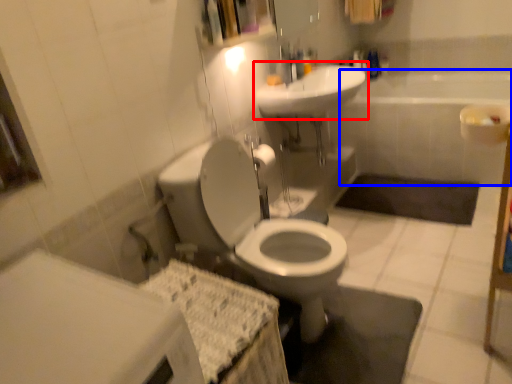
Question: Which object is further to the camera taking this photo, sink (highlighted by a red box) or bath (highlighted by a blue box)?

Choices:
 (A) sink
 (B) bath

Answer: (B)